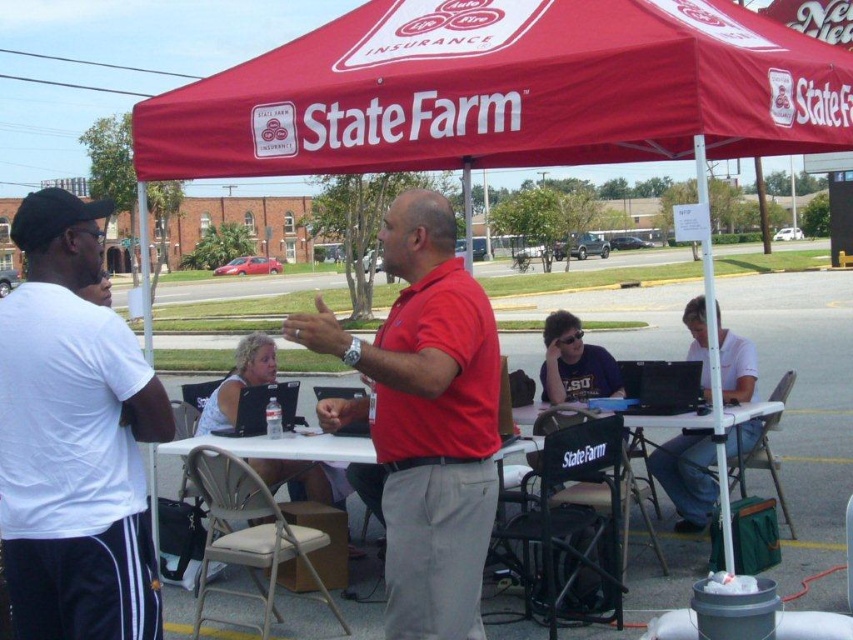
You are a photographer at the event and need to take a photo of the red matte shirt at center and the white plastic table at center. Which object is narrower in width?

The red matte shirt at center is thinner than the white plastic table at center, so the red matte shirt at center is narrower in width.

You are a customer at the State Farm event and want to approach the representative wearing the red matte shirt at center. The white plastic table at center is blocking your path. Can you walk around the table to reach the representative?

The red matte shirt at center is positioned over the white plastic table at center, meaning the table is directly beneath the representative. You can walk around the table to reach the representative since the table is stationary and the path around it is accessible.

You are a photographer at the event and want to take a photo of the white matte shirt at center and the white plastic picnic table at center. Which object should be placed closer to the camera to ensure both are in focus?

The white matte shirt at center is taller than the white plastic picnic table at center. To ensure both are in focus, the taller object, the white matte shirt at center, should be closer to the camera.